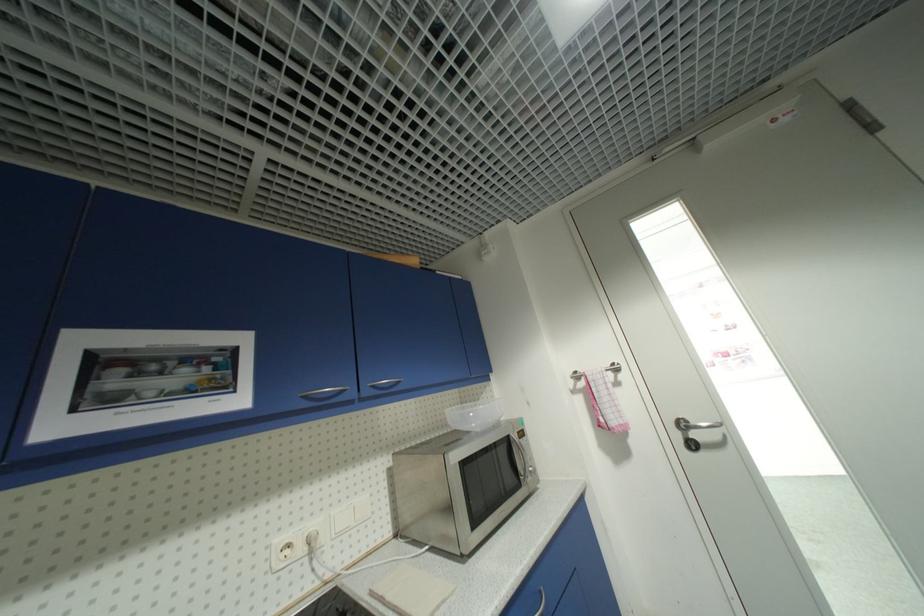
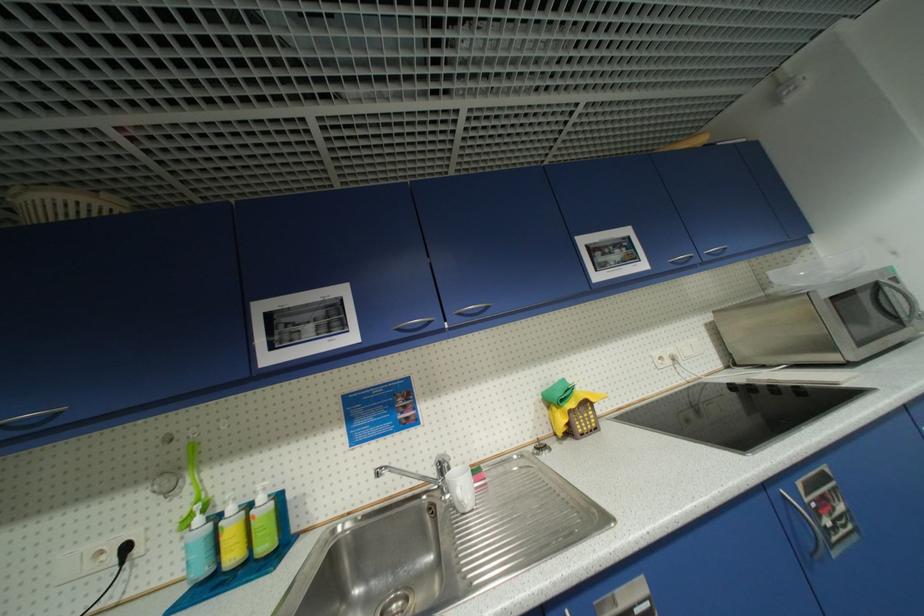
Find the pixel in the second image that matches (x=514, y=438) in the first image.

(883, 284)